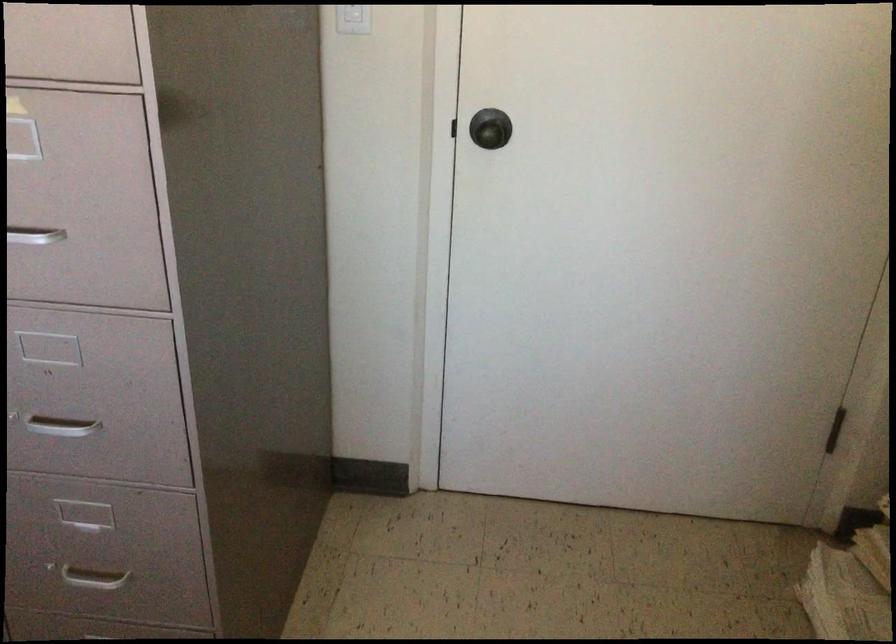
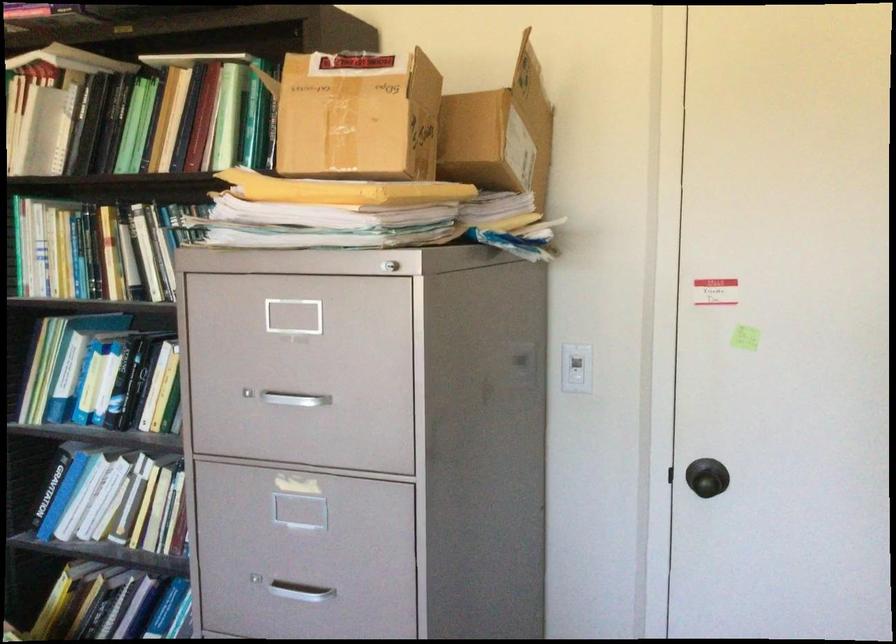
Question: The images are taken continuously from a first-person perspective. In which direction is your viewpoint rotating?

Choices:
 (A) Left
 (B) Right
 (C) Up
 (D) Down

Answer: (C)